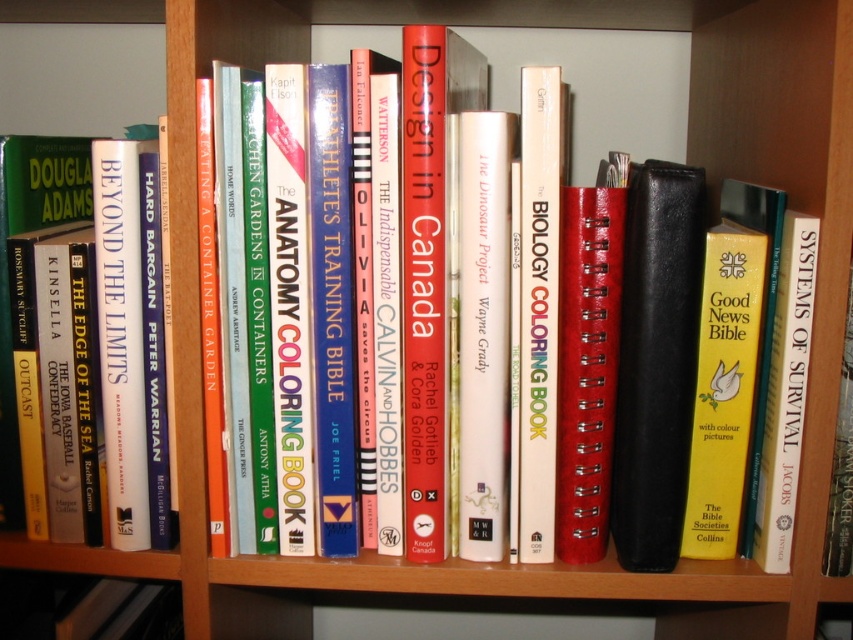
Question: Which of the following is the farthest from the observer?

Choices:
 (A) hardcover biology coloring book at center
 (B) hardback book at left

Answer: (B)

Question: Among these objects, which one is nearest to the camera?

Choices:
 (A) hardcover biology coloring book at center
 (B) hardback book at left

Answer: (A)

Question: Does hardback book at left have a larger size compared to hardcover biology coloring book at center?

Choices:
 (A) yes
 (B) no

Answer: (A)

Question: Among these objects, which one is farthest from the camera?

Choices:
 (A) hardcover biology coloring book at center
 (B) hardback book at left

Answer: (B)

Question: Is hardback book at left to the left of hardcover biology coloring book at center from the viewer's perspective?

Choices:
 (A) no
 (B) yes

Answer: (B)

Question: Can you confirm if hardback book at left is positioned to the left of hardcover biology coloring book at center?

Choices:
 (A) yes
 (B) no

Answer: (A)